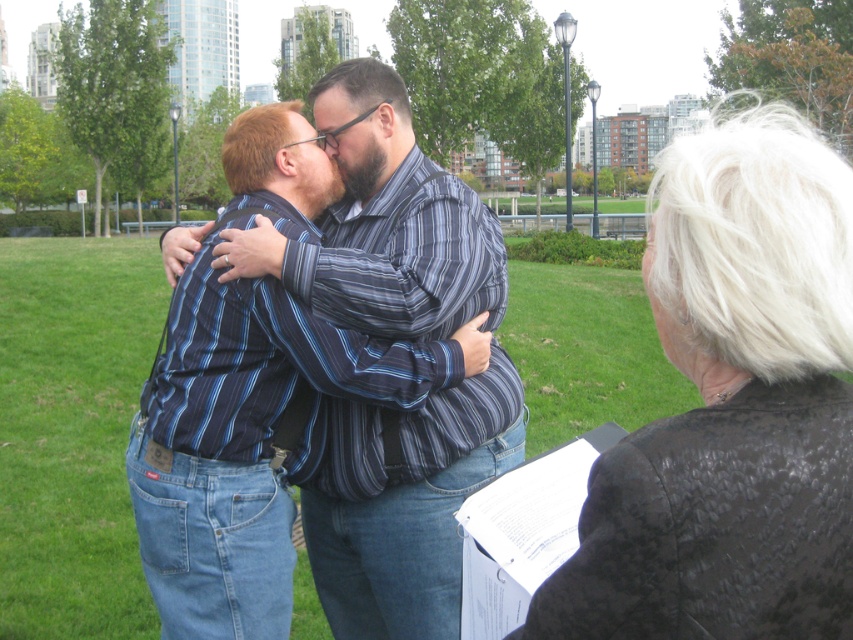
Question: Can you confirm if white textured hair at upper right is smaller than striped shirt at center?

Choices:
 (A) no
 (B) yes

Answer: (B)

Question: Is white textured hair at upper right in front of striped shirt at center?

Choices:
 (A) yes
 (B) no

Answer: (A)

Question: Does white textured hair at upper right appear over striped shirt at center?

Choices:
 (A) yes
 (B) no

Answer: (A)

Question: Which point is farther from the camera taking this photo?

Choices:
 (A) (387, 541)
 (B) (645, 433)

Answer: (A)

Question: Which of the following is the closest to the observer?

Choices:
 (A) (759, 566)
 (B) (427, 545)

Answer: (A)